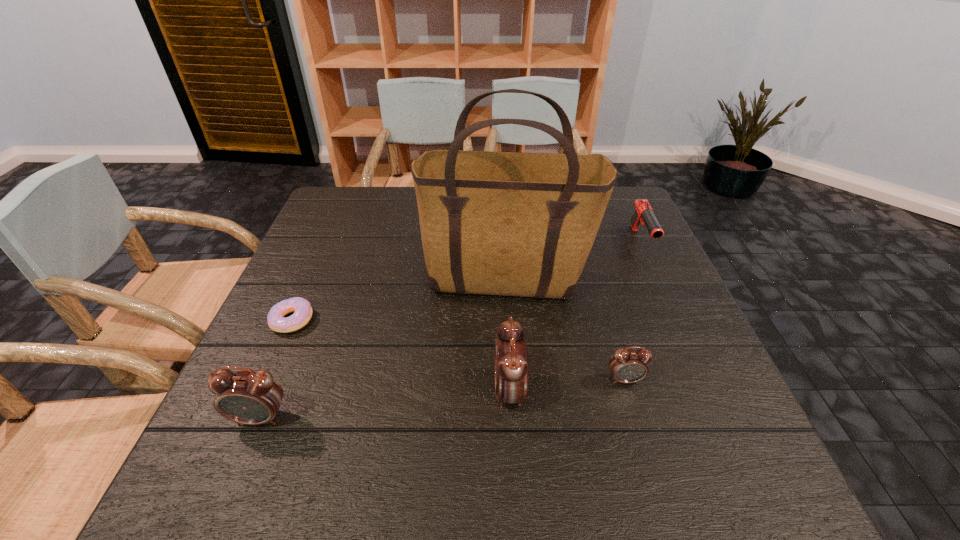
The width and height of the screenshot is (960, 540). In order to click on the fourth shortest object in this screenshot , I will do `click(248, 397)`.

This screenshot has width=960, height=540. What are the coordinates of `the second shortest alarm clock` in the screenshot? It's located at pyautogui.click(x=248, y=397).

Find the location of a particular element. The height and width of the screenshot is (540, 960). the second alarm clock from left to right is located at coordinates (511, 356).

In order to click on the shortest alarm clock in this screenshot , I will do `click(626, 366)`.

What are the coordinates of `the rightmost object` in the screenshot? It's located at (644, 213).

This screenshot has height=540, width=960. Find the location of `doughnut`. doughnut is located at coordinates (301, 307).

Where is `the tallest object`? The height and width of the screenshot is (540, 960). the tallest object is located at coordinates (519, 224).

Locate an element on the screen. vacant space located on the face of the second alarm clock from right to left is located at coordinates (392, 392).

You are a GUI agent. You are given a task and a screenshot of the screen. Output one action in this format:
    pyautogui.click(x=<x>, y=<y>)
    Task: Click on the vacant area situated on the face of the second alarm clock from right to left
    This screenshot has height=540, width=960.
    Given the screenshot: What is the action you would take?
    pyautogui.click(x=341, y=392)

I want to click on vacant space located on the face of the second alarm clock from right to left, so click(x=367, y=392).